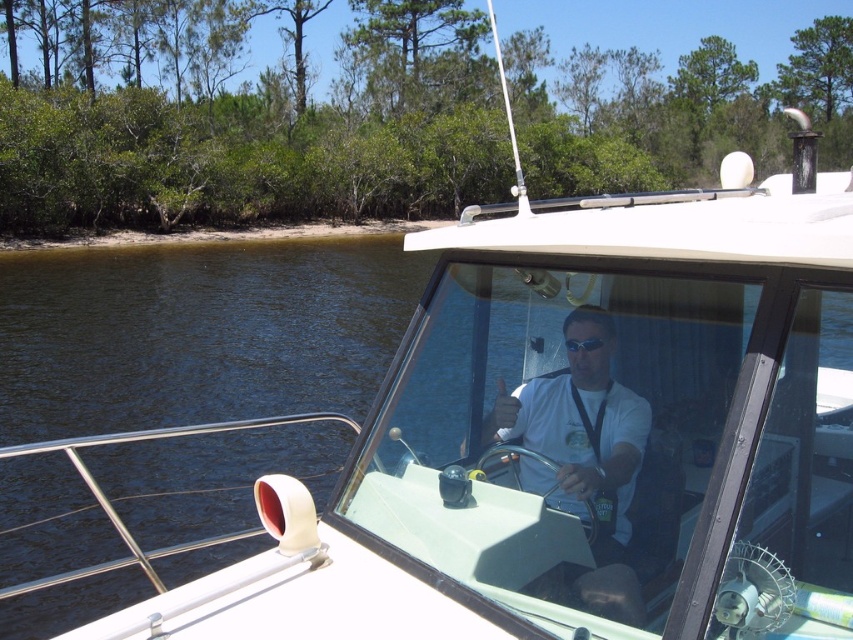
The width and height of the screenshot is (853, 640). Find the location of `white matte shirt at center`. white matte shirt at center is located at coordinates (583, 460).

What do you see at coordinates (583, 460) in the screenshot? I see `white matte shirt at center` at bounding box center [583, 460].

Image resolution: width=853 pixels, height=640 pixels. Identify the location of white matte shirt at center. (583, 460).

Where is `white matte shirt at center`? Image resolution: width=853 pixels, height=640 pixels. white matte shirt at center is located at coordinates (583, 460).